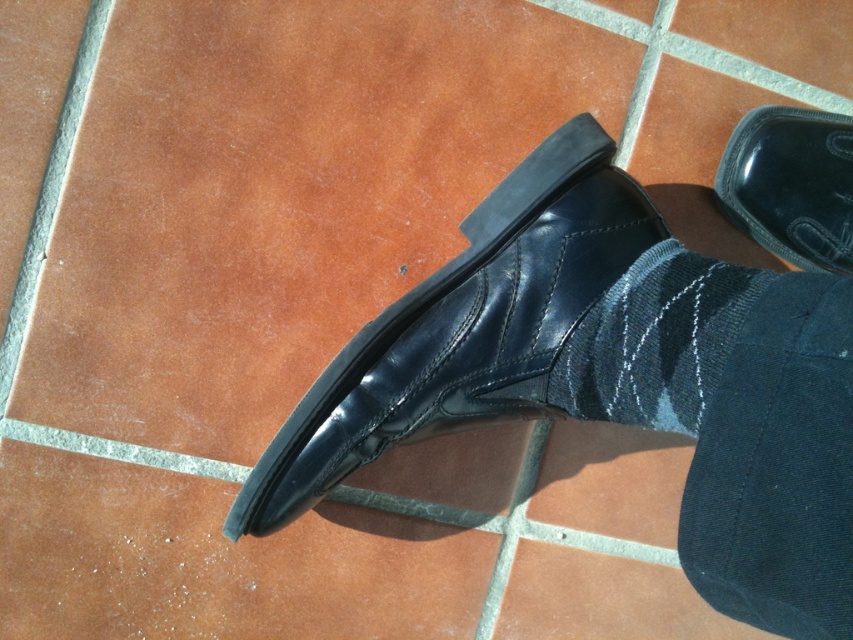
Question: Does brown matte tile at center appear over shiny black shoe at center?

Choices:
 (A) no
 (B) yes

Answer: (A)

Question: Which of the following is the closest to the observer?

Choices:
 (A) brown matte tile at center
 (B) brown leather tile at center
 (C) shiny black shoe at upper right

Answer: (B)

Question: Based on their relative distances, which object is farther from the shiny black shoe at upper right?

Choices:
 (A) brown tile at upper right
 (B) brown leather tile at center

Answer: (B)

Question: Which point appears closest to the camera in this image?

Choices:
 (A) (341, 109)
 (B) (432, 403)
 (C) (763, 125)

Answer: (B)

Question: Does shiny black shoe at center lie behind dark blue textured sock at center?

Choices:
 (A) no
 (B) yes

Answer: (B)

Question: Does brown leather tile at center appear on the left side of shiny black shoe at center?

Choices:
 (A) no
 (B) yes

Answer: (B)